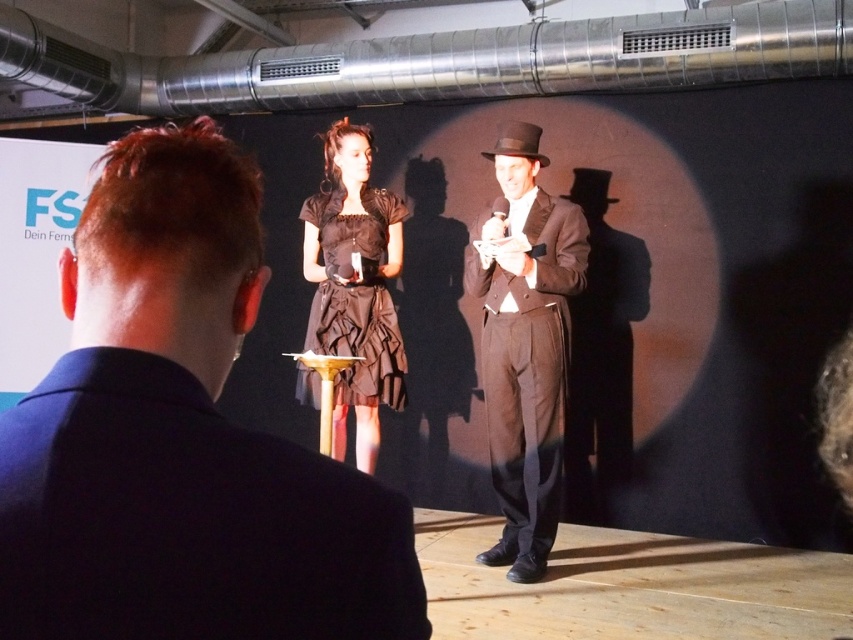
You are an event photographer positioned at the back of the venue. You need to capture a clear photo of both the matte black suit at center and the shiny brown suit at center. Which suit will appear larger in your photo?

The matte black suit at center will appear larger in the photo because it is closer to the viewer than the shiny brown suit at center.

You are an event coordinator setting up for a presentation. You need to ensure that the white matte projection screen at upper left is visible to all attendees. Considering the black satin dress at center, which is part of the stage setup, will the dress block the view of the screen?

The white matte projection screen at upper left is located above the black satin dress at center, so the dress will not block the view of the screen as it is positioned below the screen.